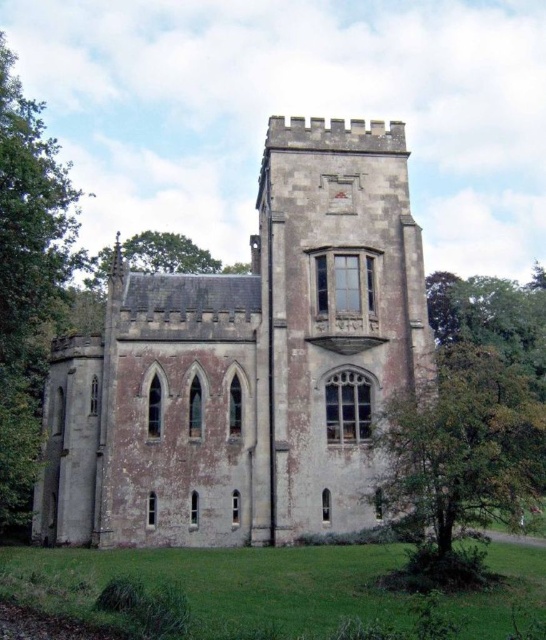
You are planning to install a fence between the two green leafy trees. The fence must be exactly 30 meters long. Based on the distance between the green leafy tree at right and the green leafy tree at left, will the fence be long enough?

The distance between the green leafy tree at right and the green leafy tree at left is 29.17 meters. Since the fence is 30 meters long, it will be long enough to span the distance between them.

You are standing in front of the historic stone building and want to take a photo that includes both the gray stone castle at center and the green leafy tree at right. Based on their positions, which object should you place closer to the center of your photo frame?

The gray stone castle at center should be placed closer to the center of your photo frame since it is positioned over the green leafy tree at right, indicating it is already centrally located.